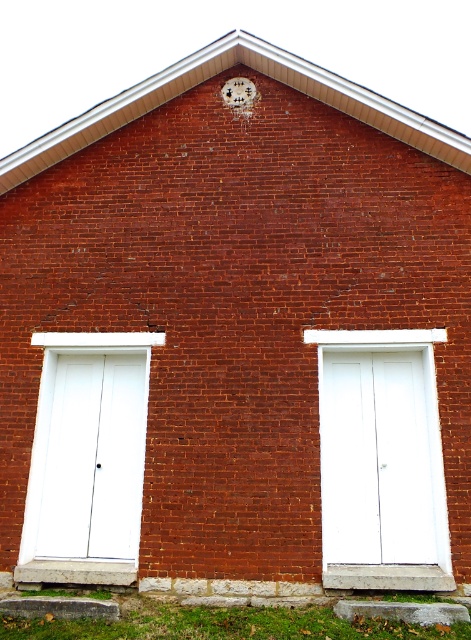
Consider the image. Is white wood door at center behind white matte door at left?

No, it is in front of white matte door at left.

Does white wood door at center have a smaller size compared to white matte door at left?

Actually, white wood door at center might be larger than white matte door at left.

Is point (437, 435) positioned before point (96, 456)?

Yes, point (437, 435) is in front of point (96, 456).

The image size is (471, 640). What are the coordinates of `white wood door at center` in the screenshot? It's located at (381, 460).